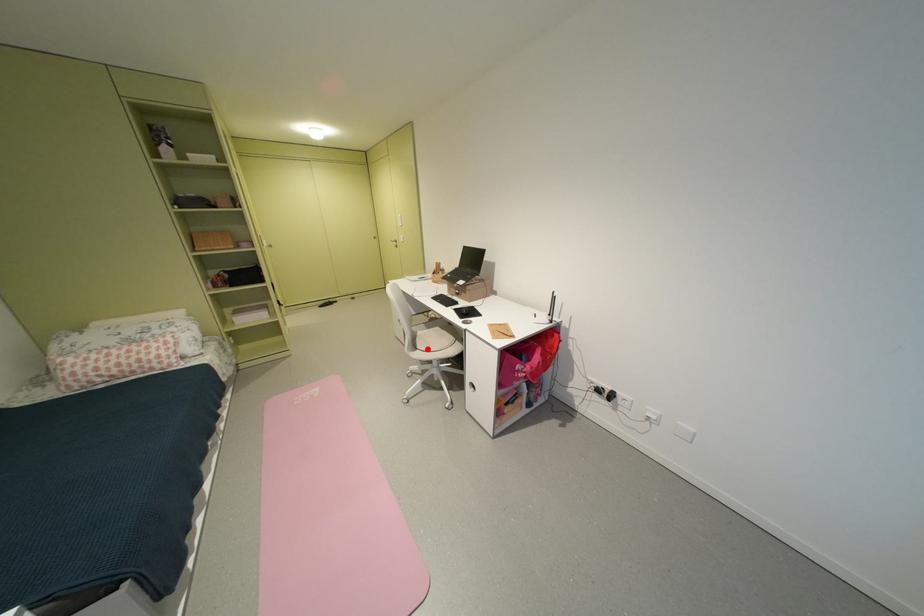
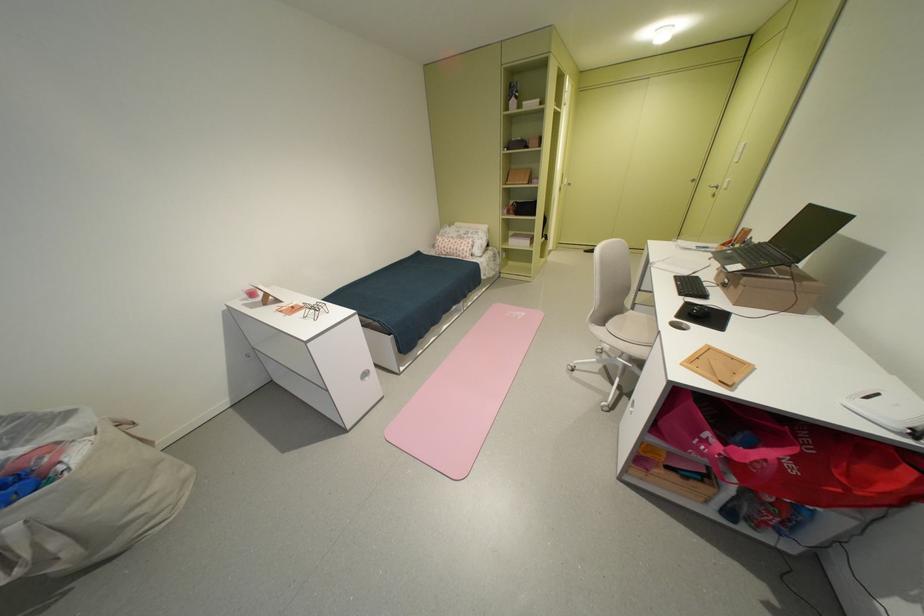
Find the pixel in the second image that matches the highlighted location in the first image.

(615, 326)